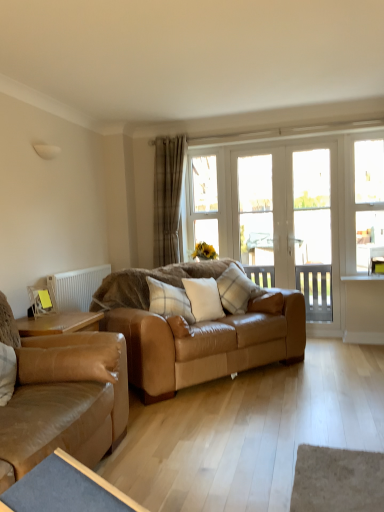
The height and width of the screenshot is (512, 384). Find the location of `free space in front of leather couch at center, which is the first studio couch in back-to-front order`. free space in front of leather couch at center, which is the first studio couch in back-to-front order is located at coordinates click(x=249, y=428).